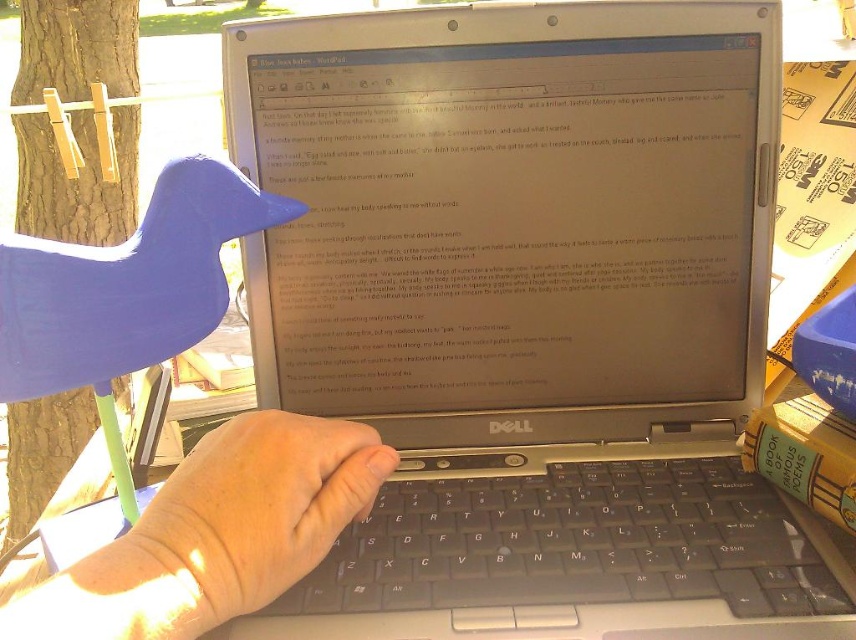
You are a robotic arm trying to reach the black plastic keyboard at center. The robotic arm has a maximum reach of 3.5 inches. Can you reach the keyboard from the current position of the skinny white hand at center?

The black plastic keyboard at center is 3.81 inches from the skinny white hand at center. Since the robotic arm can only reach up to 3.5 inches, it cannot reach the keyboard from the current position of the skinny white hand at center.

You are a photographer adjusting your camera to focus on the laptop screen. There are two points marked in the scene, point (x=428, y=497) and point (x=265, y=509). Which point should you focus on to ensure the laptop screen is in sharp focus?

You should focus on point (x=428, y=497) because it is closer to the camera than point (x=265, y=509), which would help ensure the laptop screen is in sharp focus.

You are a photographer trying to capture the silver metallic laptop at center and the black plastic keyboard at center in a single shot. Based on their sizes, which object will appear larger in the photo?

The silver metallic laptop at center is much taller than the black plastic keyboard at center, so it will appear larger in the photo.